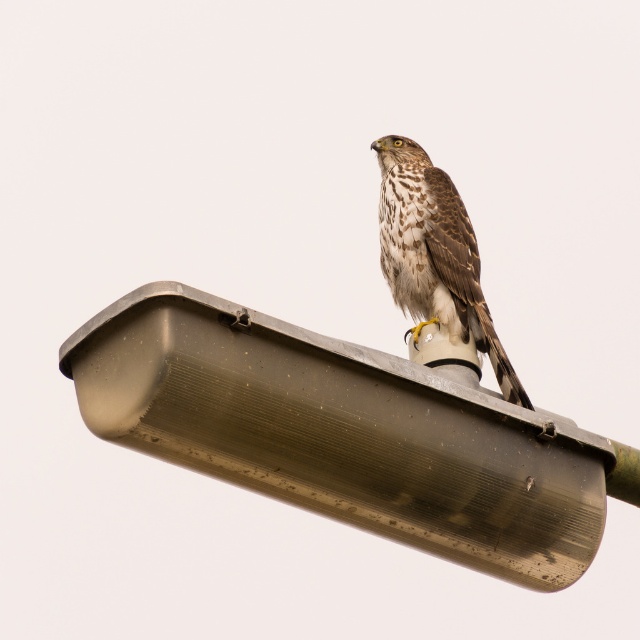
Who is lower down, metallic gray lamp post at upper center or brown speckled feathers at upper center?

Positioned lower is metallic gray lamp post at upper center.

Consider the image. Which is above, metallic gray lamp post at upper center or brown speckled feathers at upper center?

brown speckled feathers at upper center is above.

Is point (365, 388) farther from camera compared to point (486, 310)?

No, it is in front of (486, 310).

You are a GUI agent. You are given a task and a screenshot of the screen. Output one action in this format:
    pyautogui.click(x=<x>, y=<y>)
    Task: Click on the metallic gray lamp post at upper center
    The image size is (640, 640).
    Given the screenshot: What is the action you would take?
    pyautogui.click(x=348, y=433)